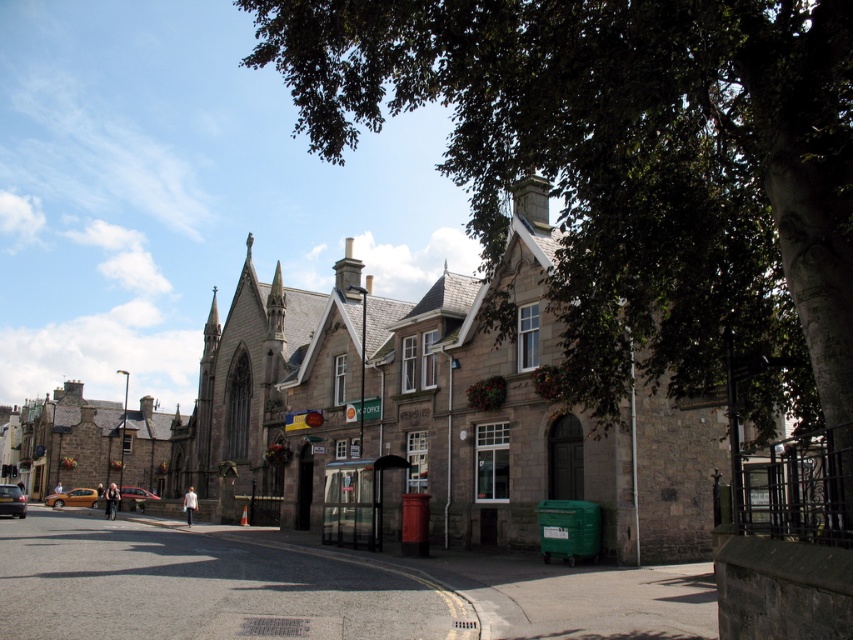
Does orange metallic car at lower left appear on the right side of matte black car at lower left?

In fact, orange metallic car at lower left is to the left of matte black car at lower left.

Image resolution: width=853 pixels, height=640 pixels. What are the coordinates of `orange metallic car at lower left` in the screenshot? It's located at (73, 497).

Describe the element at coordinates (73, 497) in the screenshot. Image resolution: width=853 pixels, height=640 pixels. I see `orange metallic car at lower left` at that location.

Image resolution: width=853 pixels, height=640 pixels. I want to click on orange metallic car at lower left, so click(73, 497).

The height and width of the screenshot is (640, 853). What do you see at coordinates (10, 500) in the screenshot?
I see `matte black car at lower left` at bounding box center [10, 500].

Does matte black car at lower left appear under metallic silver car at lower left?

Actually, matte black car at lower left is above metallic silver car at lower left.

Find the location of a particular element. The image size is (853, 640). matte black car at lower left is located at coordinates (10, 500).

This screenshot has width=853, height=640. In order to click on green leafy tree at upper center in this screenshot , I will do `click(628, 168)`.

Which of these two, green leafy tree at upper center or matte black car at lower left, stands taller?

green leafy tree at upper center is taller.

Who is more distant from viewer, (538, 161) or (0, 493)?

The point (0, 493) is more distant.

Where is `green leafy tree at upper center`? green leafy tree at upper center is located at coordinates (628, 168).